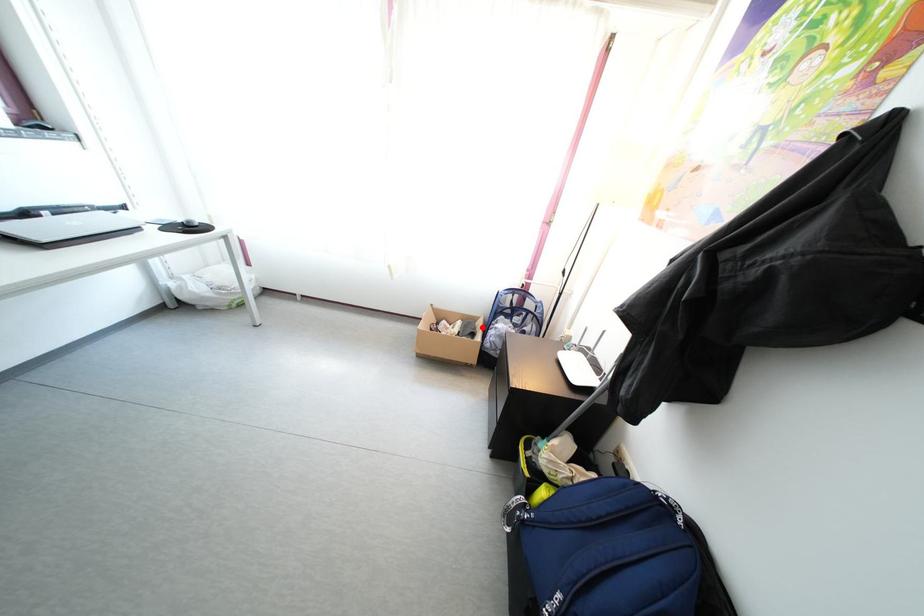
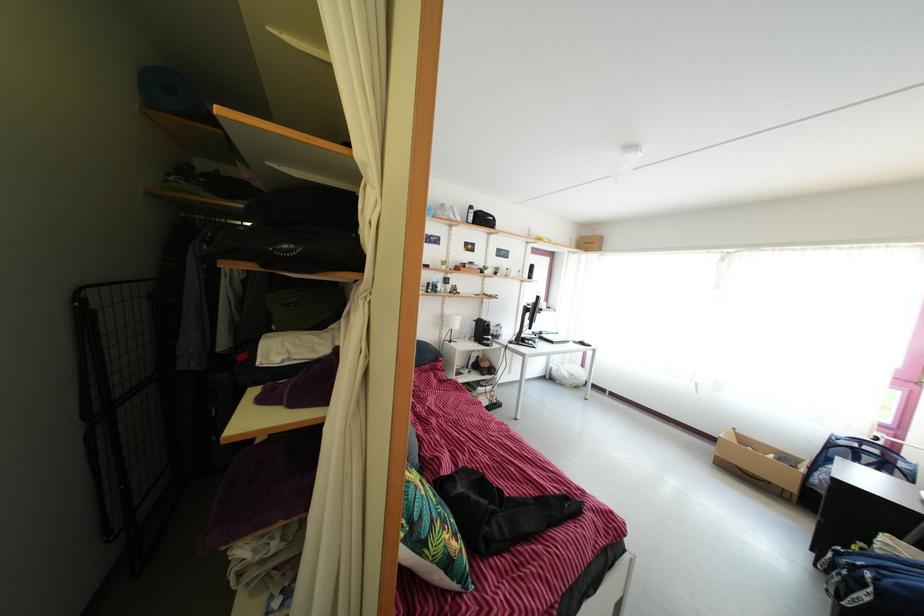
Where in the second image is the point corresponding to the highlighted location from the first image?

(805, 468)